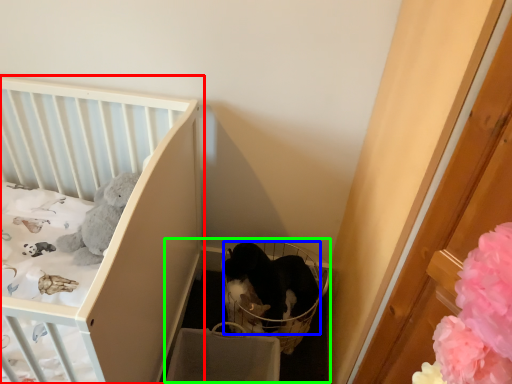
Question: Estimate the real-world distances between objects in this image. Which object is closer to infant bed (highlighted by a red box), cat (highlighted by a blue box) or baby carriage (highlighted by a green box)?

Choices:
 (A) cat
 (B) baby carriage

Answer: (B)